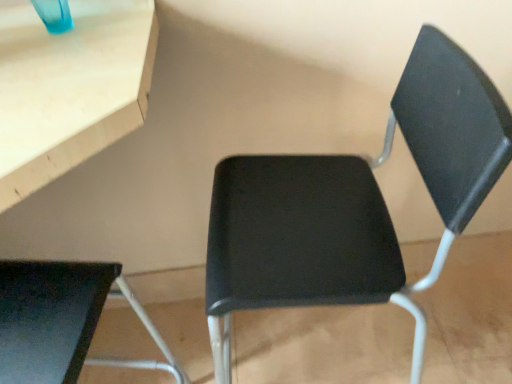
What do you see at coordinates (354, 203) in the screenshot? The width and height of the screenshot is (512, 384). I see `black matte chair at center` at bounding box center [354, 203].

You are a GUI agent. You are given a task and a screenshot of the screen. Output one action in this format:
    pyautogui.click(x=<x>, y=<y>)
    Task: Click on the black matte chair at center
    The width and height of the screenshot is (512, 384).
    Given the screenshot: What is the action you would take?
    coord(354,203)

Where is `black matte chair at center`? black matte chair at center is located at coordinates (354, 203).